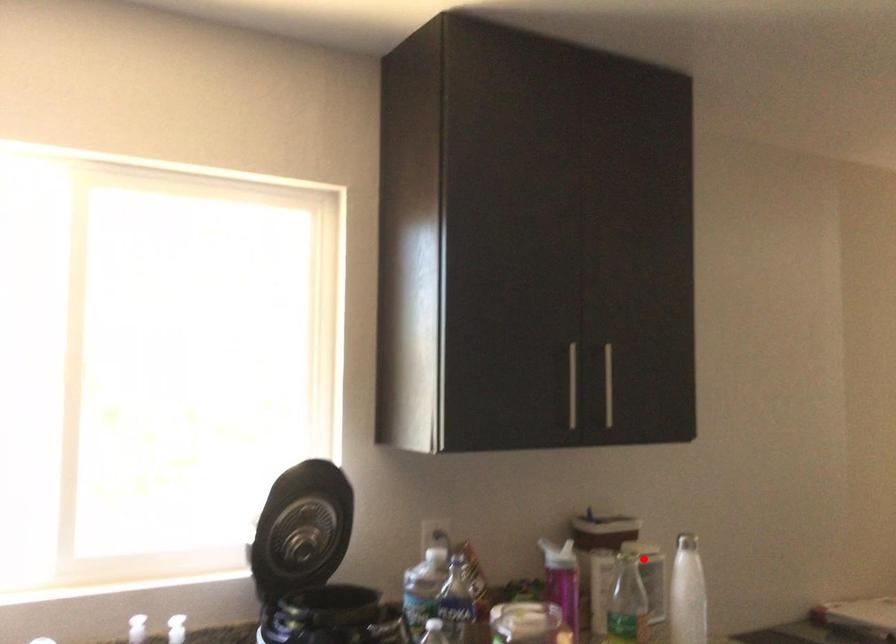
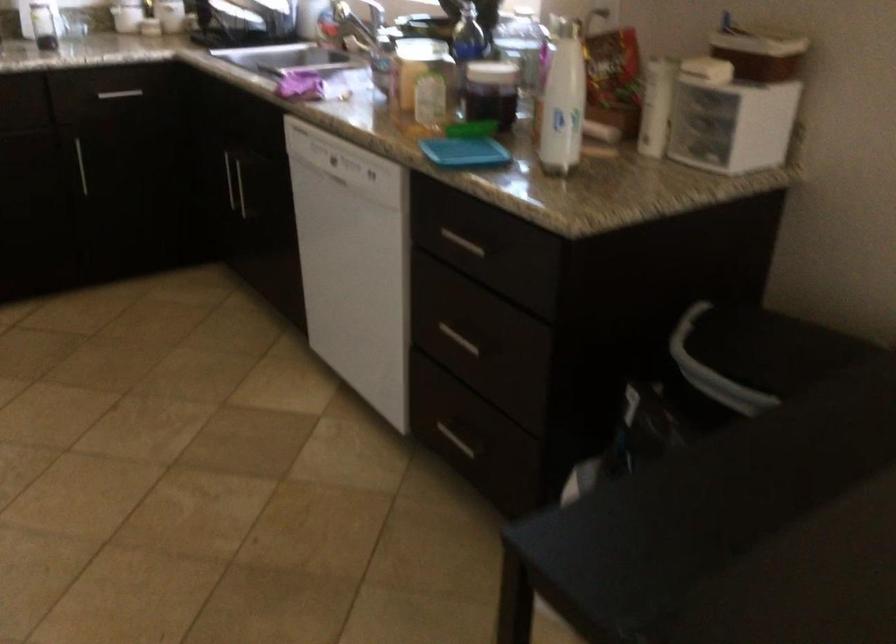
Question: A red point is marked in image1. In image2, is the corresponding 3D point closer to the camera or farther? Reply with the corresponding letter.

Choices:
 (A) The corresponding 3D point is closer.
 (B) The corresponding 3D point is farther.

Answer: (A)